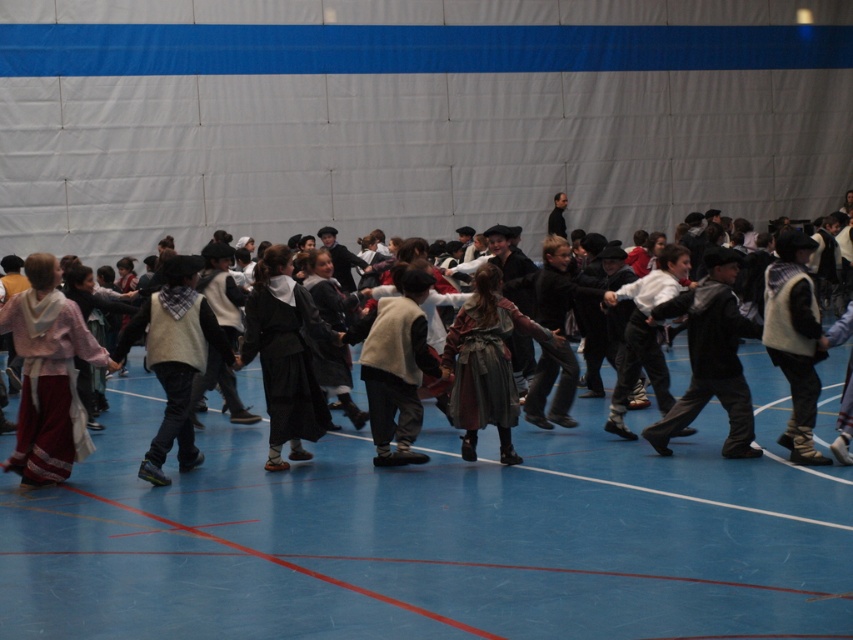
Does blue rubber floor at center appear under velvet black vest at center?

Yes, blue rubber floor at center is below velvet black vest at center.

Is blue rubber floor at center smaller than velvet black vest at center?

Correct, blue rubber floor at center occupies less space than velvet black vest at center.

Is point (706, 406) farther from camera compared to point (618, 538)?

Yes, it is.

The image size is (853, 640). Find the location of `blue rubber floor at center`. blue rubber floor at center is located at coordinates (430, 538).